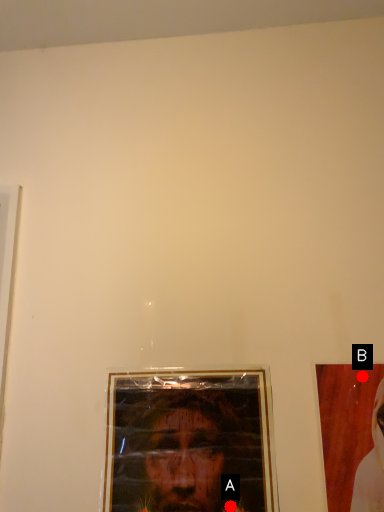
Question: Two points are circled on the image, labeled by A and B beside each circle. Which point appears closest to the camera in this image?

Choices:
 (A) A is closer
 (B) B is closer

Answer: (A)